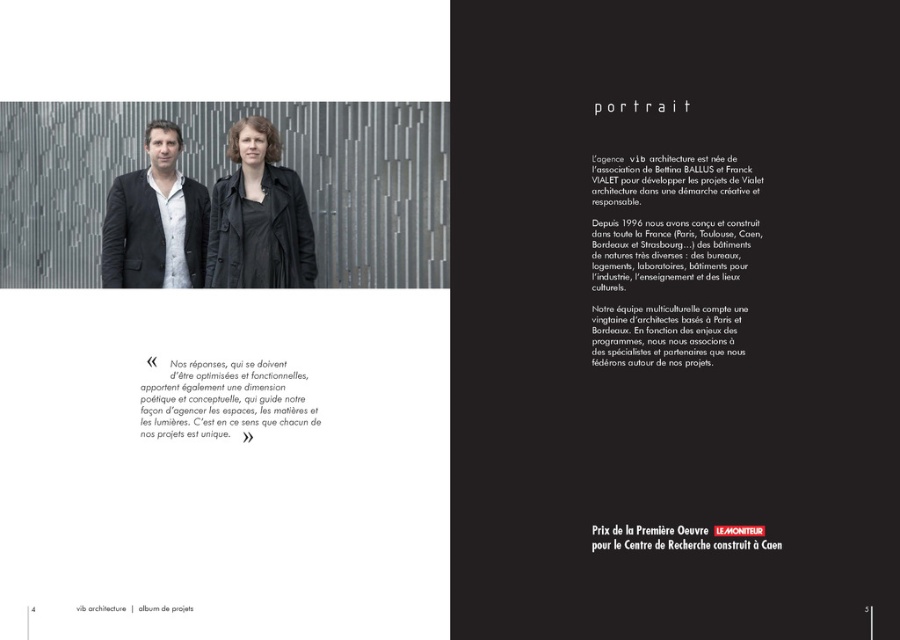
Does black matte jacket at center come in front of matte black jacket at center?

Yes, it is.

Is point (271, 140) positioned in front of point (172, 150)?

Yes, it is in front of point (172, 150).

I want to click on black matte jacket at center, so click(258, 216).

In the scene shown: Can you confirm if black matte jacket at center is thinner than black paper quote at center?

Yes, black matte jacket at center is thinner than black paper quote at center.

Between point (297, 280) and point (199, 374), which one is positioned behind?

Positioned behind is point (297, 280).

Is point (307, 285) closer to viewer compared to point (154, 413)?

No, it is behind (154, 413).

The image size is (900, 640). Identify the location of black matte jacket at center. (258, 216).

Does matte black jacket at center appear under black paper quote at center?

No, matte black jacket at center is not below black paper quote at center.

Is matte black jacket at center positioned in front of black paper quote at center?

No, matte black jacket at center is further to the viewer.

Does point (180, 276) come farther from viewer compared to point (310, 420)?

Yes, it is.

What are the coordinates of `matte black jacket at center` in the screenshot? It's located at click(x=155, y=220).